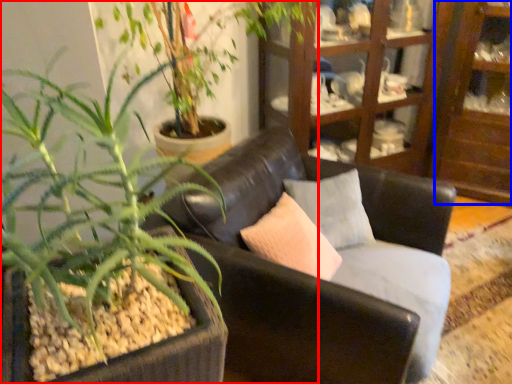
Question: Which object is further to the camera taking this photo, houseplant (highlighted by a red box) or shelf (highlighted by a blue box)?

Choices:
 (A) houseplant
 (B) shelf

Answer: (B)